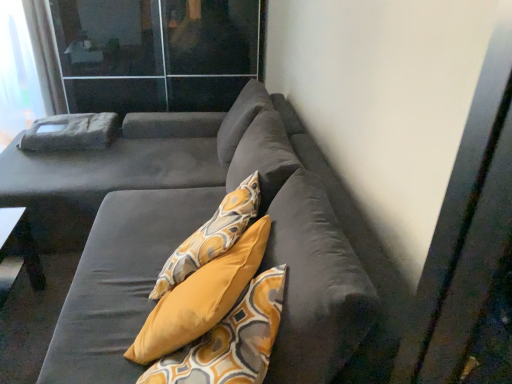
Question: Considering the positions of white sheer curtain at upper left and transparent glass screen door at upper left in the image, is white sheer curtain at upper left taller or shorter than transparent glass screen door at upper left?

Choices:
 (A) short
 (B) tall

Answer: (A)

Question: Is white sheer curtain at upper left situated inside transparent glass screen door at upper left or outside?

Choices:
 (A) inside
 (B) outside

Answer: (B)

Question: Estimate the real-world distances between objects in this image. Which object is farther from the transparent glass screen door at upper left?

Choices:
 (A) suede gray couch at center
 (B) white sheer curtain at upper left

Answer: (A)

Question: Estimate the real-world distances between objects in this image. Which object is farther from the transparent glass screen door at upper left?

Choices:
 (A) suede gray couch at center
 (B) white sheer curtain at upper left

Answer: (A)